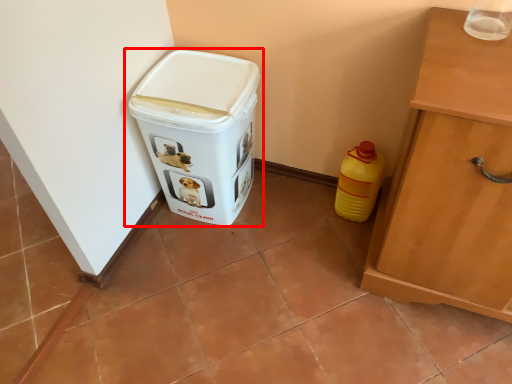
Question: From the image's perspective, what is the correct spatial positioning of waste container (annotated by the red box) in reference to bottle?

Choices:
 (A) above
 (B) below

Answer: (A)